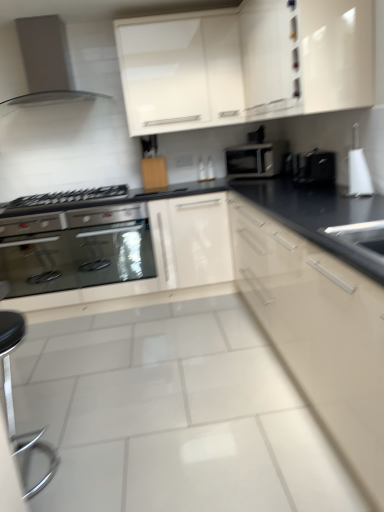
Question: Could you tell me if wooden cutting board at center, the first cabinetry viewed from the left, is turned towards stainless steel oven at lower left?

Choices:
 (A) no
 (B) yes

Answer: (A)

Question: Considering the relative sizes of wooden cutting board at center, marked as the third cabinetry in a right-to-left arrangement, and stainless steel oven at lower left in the image provided, is wooden cutting board at center, marked as the third cabinetry in a right-to-left arrangement, wider than stainless steel oven at lower left?

Choices:
 (A) no
 (B) yes

Answer: (A)

Question: Is wooden cutting board at center, marked as the third cabinetry in a right-to-left arrangement, smaller than stainless steel oven at lower left?

Choices:
 (A) yes
 (B) no

Answer: (A)

Question: Is wooden cutting board at center, marked as the third cabinetry in a right-to-left arrangement, to the left of stainless steel oven at lower left from the viewer's perspective?

Choices:
 (A) no
 (B) yes

Answer: (A)

Question: Is stainless steel oven at lower left located within wooden cutting board at center, the first cabinetry viewed from the left?

Choices:
 (A) no
 (B) yes

Answer: (A)

Question: From a real-world perspective, is satin metallic range hood at upper left positioned above or below white glossy cabinet at upper center, the 2th cabinetry viewed from the right?

Choices:
 (A) above
 (B) below

Answer: (A)

Question: From their relative heights in the image, would you say satin metallic range hood at upper left is taller or shorter than white glossy cabinet at upper center, which is counted as the second cabinetry, starting from the left?

Choices:
 (A) short
 (B) tall

Answer: (A)

Question: Relative to white glossy cabinet at upper center, which is counted as the second cabinetry, starting from the left, is satin metallic range hood at upper left in front or behind?

Choices:
 (A) front
 (B) behind

Answer: (A)

Question: From the image's perspective, is satin metallic range hood at upper left located above or below white glossy cabinet at upper center, which is counted as the second cabinetry, starting from the left?

Choices:
 (A) below
 (B) above

Answer: (B)

Question: Is point (357, 159) closer or farther from the camera than point (41, 58)?

Choices:
 (A) farther
 (B) closer

Answer: (B)

Question: Relative to satin metallic range hood at upper left, is white glossy kettle at upper right, the first appliance viewed from the front, in front or behind?

Choices:
 (A) behind
 (B) front

Answer: (B)

Question: Considering the positions of white glossy kettle at upper right, the first appliance viewed from the front, and satin metallic range hood at upper left in the image, is white glossy kettle at upper right, the first appliance viewed from the front, wider or thinner than satin metallic range hood at upper left?

Choices:
 (A) thin
 (B) wide

Answer: (A)

Question: From the image's perspective, is white glossy kettle at upper right, which is counted as the second appliance, starting from the back, located above or below satin metallic range hood at upper left?

Choices:
 (A) above
 (B) below

Answer: (B)

Question: Looking at their shapes, would you say wooden cutting board at center, marked as the third cabinetry in a right-to-left arrangement, is wider or thinner than satin metallic range hood at upper left?

Choices:
 (A) wide
 (B) thin

Answer: (B)

Question: Is point (145, 172) positioned closer to the camera than point (51, 88)?

Choices:
 (A) closer
 (B) farther

Answer: (B)